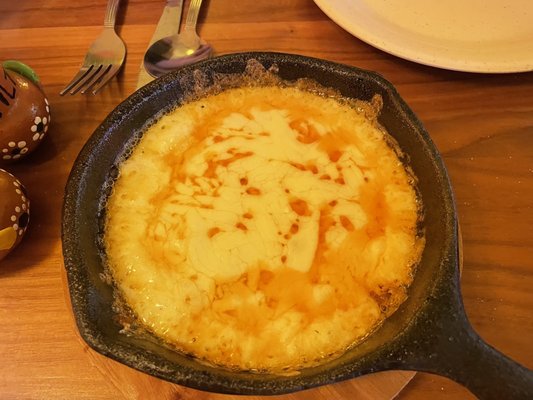
Where is `spoon`? Image resolution: width=533 pixels, height=400 pixels. spoon is located at coordinates (185, 52).